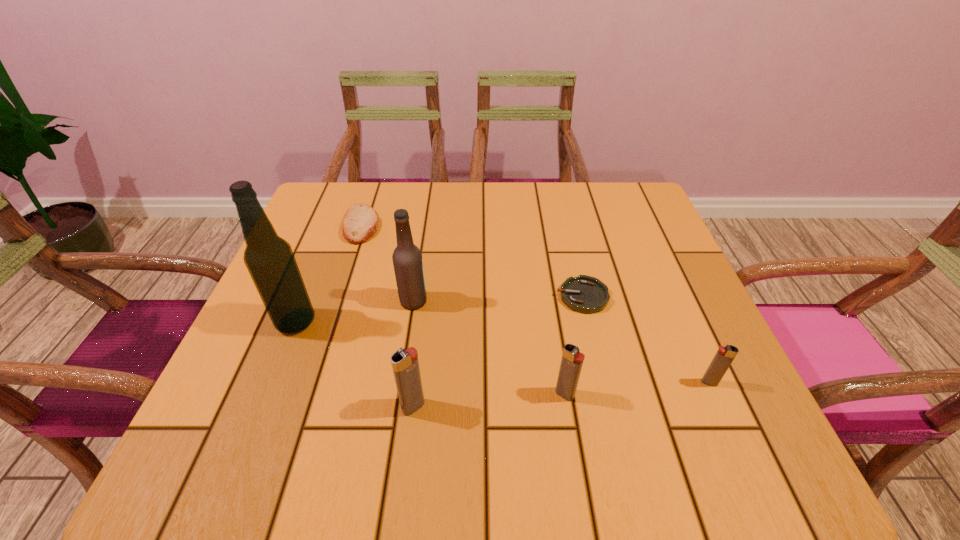
The width and height of the screenshot is (960, 540). Find the location of `vacant space that's between the fifth shortest object and the second igniter from left to right`. vacant space that's between the fifth shortest object and the second igniter from left to right is located at coordinates (490, 401).

This screenshot has width=960, height=540. Find the location of `object that ranks as the closest to the farthest object`. object that ranks as the closest to the farthest object is located at coordinates (407, 259).

Find the location of `the sixth closest object relative to the pita bread`. the sixth closest object relative to the pita bread is located at coordinates (723, 358).

Identify which igniter is the third nearest to the alcohol. Please provide its 2D coordinates. Your answer should be formatted as a tuple, i.e. [(x, y)], where the tuple contains the x and y coordinates of a point satisfying the conditions above.

[(723, 358)]

Identify the location of the second closest igniter relative to the fifth object from left to right. This screenshot has height=540, width=960. (723, 358).

Where is `free space that satisfies the following two spatial constraints: 1. on the back side of the second igniter from right to left; 2. on the left side of the third tallest object`? The height and width of the screenshot is (540, 960). free space that satisfies the following two spatial constraints: 1. on the back side of the second igniter from right to left; 2. on the left side of the third tallest object is located at coordinates (415, 394).

Identify the location of free spot that satisfies the following two spatial constraints: 1. on the front side of the tallest object; 2. on the left side of the farthest igniter. (272, 382).

Locate an element on the screen. This screenshot has height=540, width=960. free space that satisfies the following two spatial constraints: 1. on the front side of the third nearest object; 2. on the right side of the tallest object is located at coordinates (272, 382).

The height and width of the screenshot is (540, 960). I want to click on free space that satisfies the following two spatial constraints: 1. on the front side of the sixth object from left to right; 2. on the right side of the farthest igniter, so click(603, 382).

Image resolution: width=960 pixels, height=540 pixels. What are the coordinates of `vacant position in the image that satisfies the following two spatial constraints: 1. on the front side of the fourth tallest object; 2. on the left side of the tallest object` in the screenshot? It's located at (267, 394).